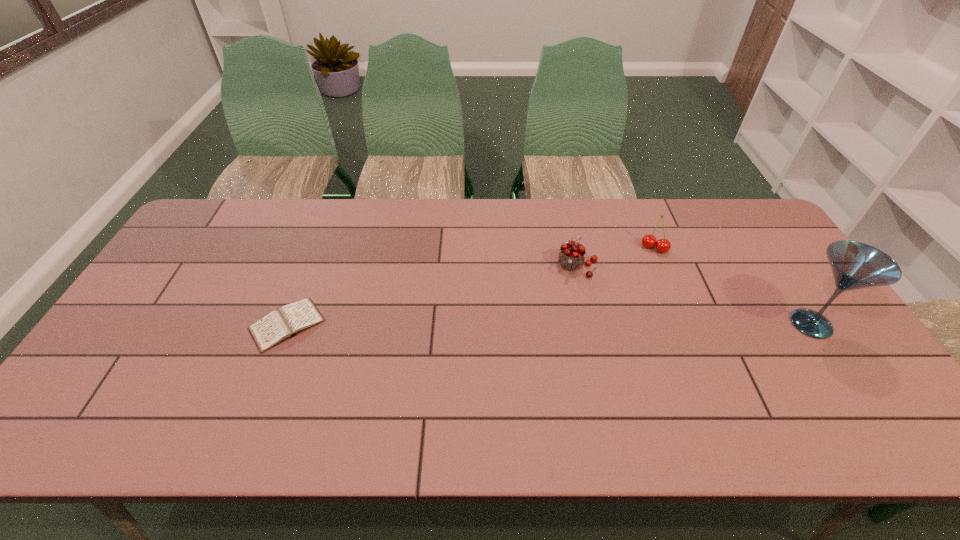
Find the location of `unoccupied position between the martini and the third object from left to right`. unoccupied position between the martini and the third object from left to right is located at coordinates tap(732, 286).

The height and width of the screenshot is (540, 960). In order to click on vacant area that lies between the right pot filled with cherries and the diary in this screenshot , I will do `click(470, 286)`.

This screenshot has width=960, height=540. Identify the location of empty space that is in between the martini and the diary. (549, 325).

The width and height of the screenshot is (960, 540). What are the coordinates of `free space between the shortest object and the left pot filled with cherries` in the screenshot? It's located at (432, 295).

This screenshot has width=960, height=540. I want to click on vacant region between the leftmost object and the tallest object, so click(x=549, y=325).

Locate an element on the screen. free spot between the martini and the diary is located at coordinates (549, 325).

Find the location of a particular element. blank region between the tallest object and the diary is located at coordinates (549, 325).

Find the location of a particular element. The height and width of the screenshot is (540, 960). free space between the third object from right to left and the right pot filled with cherries is located at coordinates (615, 257).

Locate an element on the screen. The image size is (960, 540). empty space that is in between the third object from right to left and the tallest object is located at coordinates (694, 295).

Where is `unoccupied position between the left pot filled with cherries and the shortest object`? This screenshot has width=960, height=540. unoccupied position between the left pot filled with cherries and the shortest object is located at coordinates (432, 295).